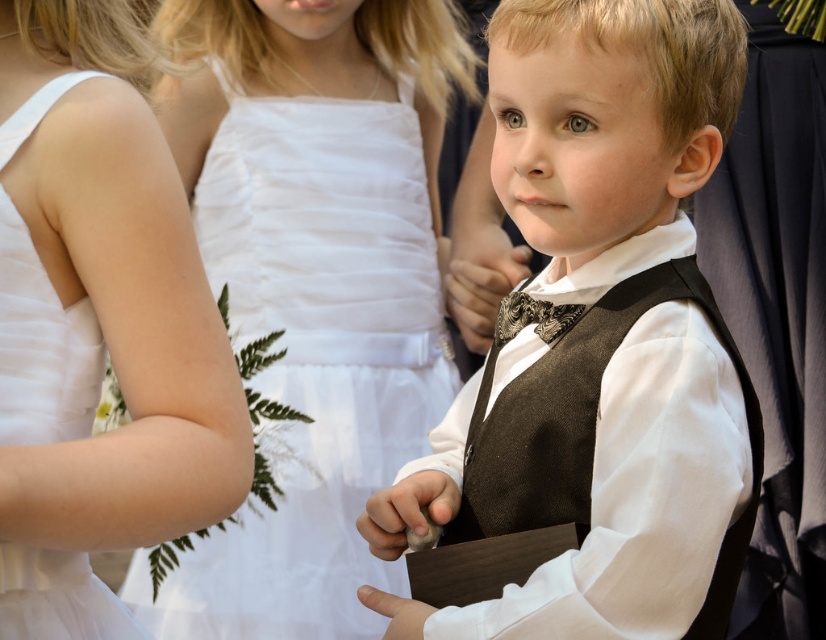
Question: Is matte brown vest at center below white satin dress at upper left?

Choices:
 (A) no
 (B) yes

Answer: (A)

Question: Is white satin dress at upper left positioned behind shiny metallic bow tie at center?

Choices:
 (A) yes
 (B) no

Answer: (B)

Question: Among these points, which one is farthest from the camera?

Choices:
 (A) (279, 227)
 (B) (520, 296)
 (C) (565, 368)

Answer: (A)

Question: From the image, what is the correct spatial relationship of white tulle dress at center in relation to shiny metallic bow tie at center?

Choices:
 (A) above
 (B) below

Answer: (B)

Question: Which object is closer to the camera taking this photo?

Choices:
 (A) shiny metallic bow tie at center
 (B) white tulle dress at center

Answer: (A)

Question: Which object is closer to the camera taking this photo?

Choices:
 (A) shiny metallic bow tie at center
 (B) white tulle dress at center
 (C) white satin dress at upper left
 (D) matte brown vest at center

Answer: (C)